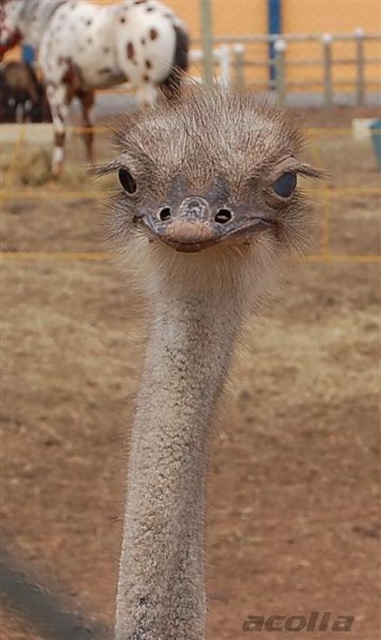
Question: Which point is closer to the camera?

Choices:
 (A) gray feathered ostrich head at upper center
 (B) gray feathered ostrich at center

Answer: (B)

Question: Can you confirm if gray feathered ostrich at center is bigger than gray feathered ostrich head at upper center?

Choices:
 (A) no
 (B) yes

Answer: (A)

Question: Can you confirm if gray feathered ostrich at center is wider than gray feathered ostrich head at upper center?

Choices:
 (A) no
 (B) yes

Answer: (A)

Question: Which object is farther from the camera taking this photo?

Choices:
 (A) gray feathered ostrich at center
 (B) gray feathered ostrich head at upper center

Answer: (B)

Question: Among these objects, which one is farthest from the camera?

Choices:
 (A) gray feathered ostrich head at upper center
 (B) gray feathered ostrich at center

Answer: (A)

Question: Does gray feathered ostrich at center come in front of gray feathered ostrich head at upper center?

Choices:
 (A) no
 (B) yes

Answer: (B)